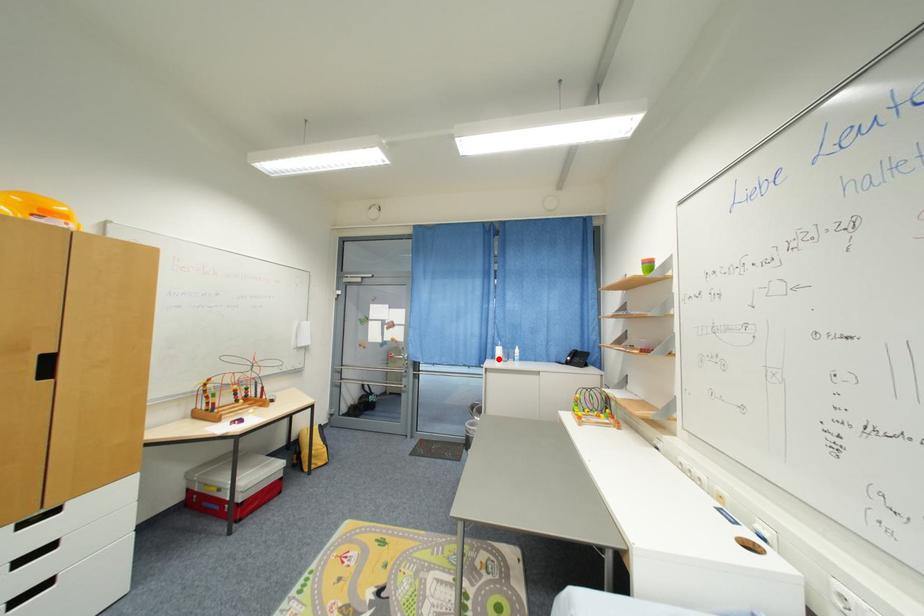
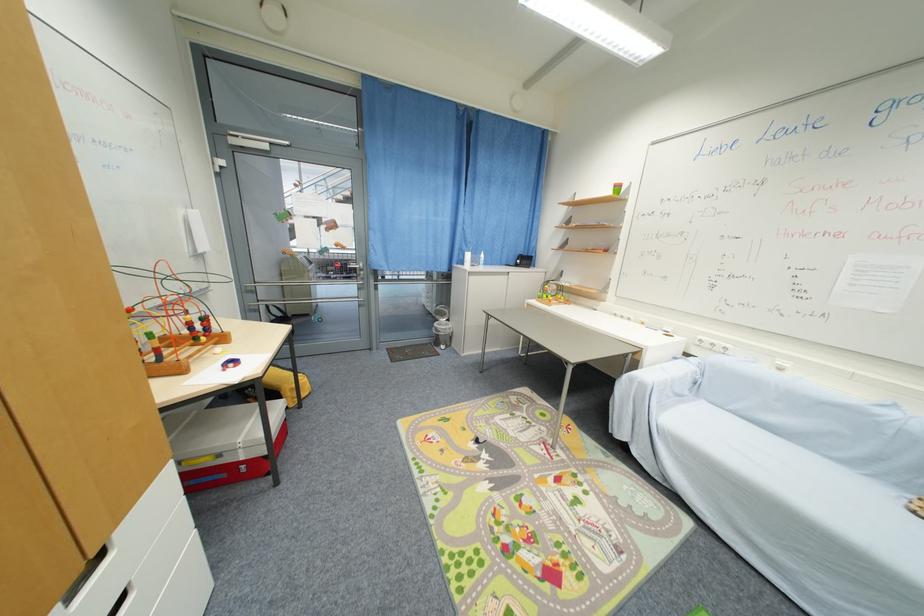
Where in the second image is the point corresponding to the highlighted location from the first image?

(467, 264)